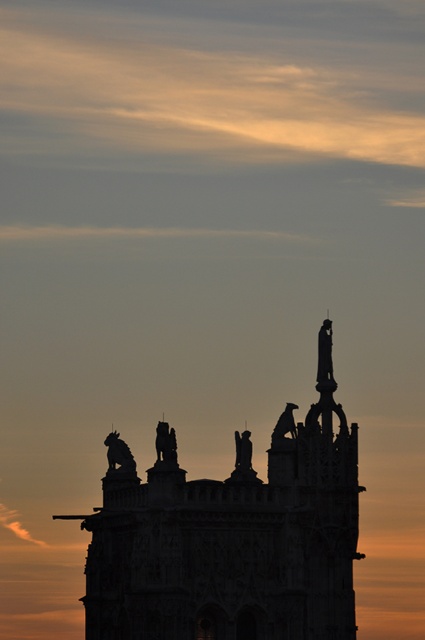
What are the coordinates of `silvery metal statue at upper center` in the screenshot? It's located at (325, 358).

This screenshot has width=425, height=640. Identify the location of silvery metal statue at upper center. (325, 358).

Between point (255, 508) and point (161, 436), which one is positioned in front?

Point (161, 436) is in front.

Is point (146, 520) less distant than point (155, 444)?

That is True.

Locate an element on the screen. Image resolution: width=425 pixels, height=640 pixels. silhouette stone tower at center is located at coordinates (232, 545).

Does sculpted stone statue at center have a lesser width compared to matte stone statue at upper center?

No, sculpted stone statue at center is not thinner than matte stone statue at upper center.

I want to click on sculpted stone statue at center, so click(166, 444).

Is point (169, 451) positioned after point (288, 412)?

No, (169, 451) is in front of (288, 412).

This screenshot has height=640, width=425. Find the location of `sculpted stone statue at center`. sculpted stone statue at center is located at coordinates (166, 444).